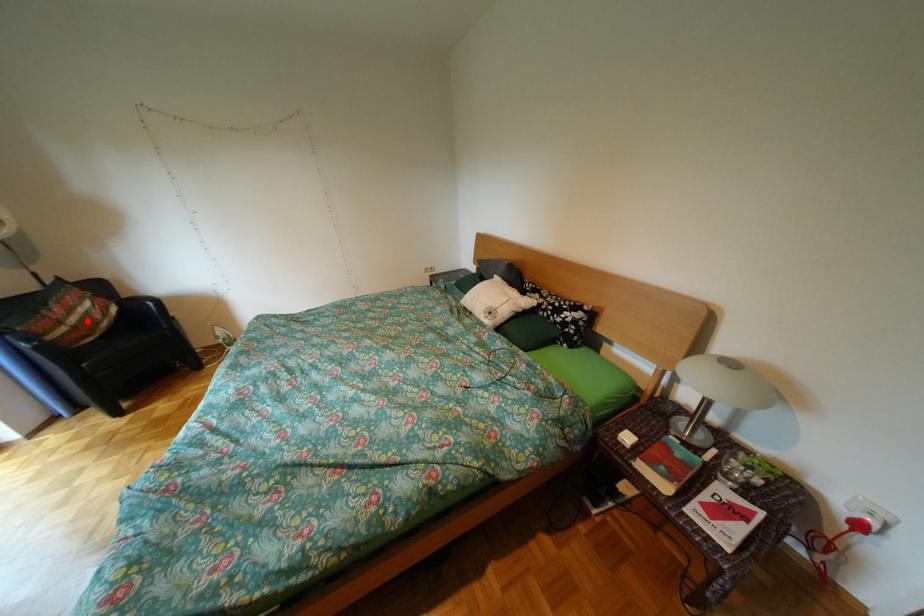
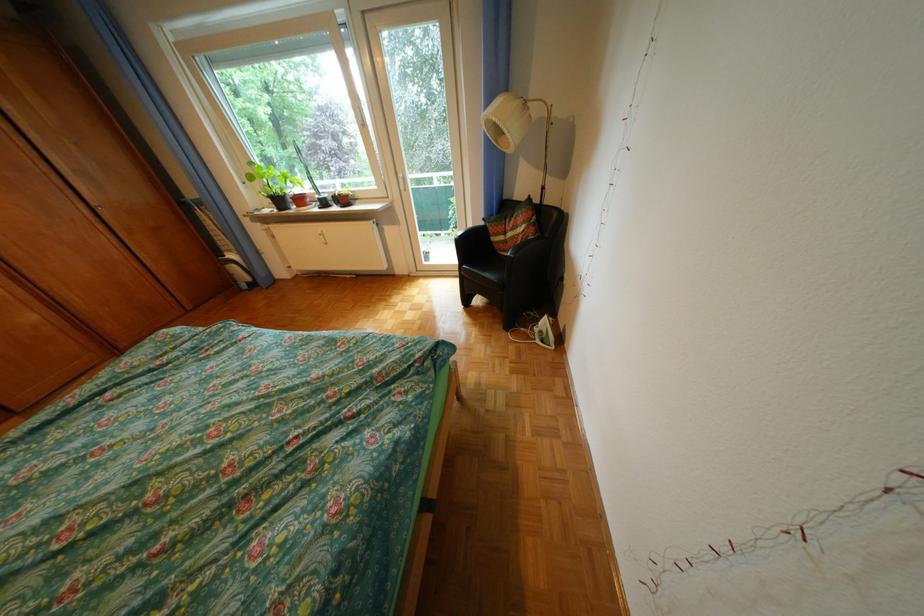
The point at the highlighted location is marked in the first image. Where is the corresponding point in the second image?

(524, 236)